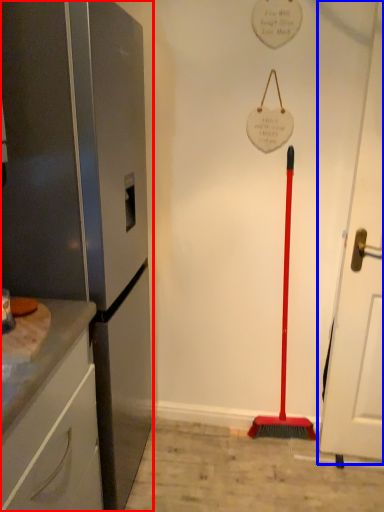
Question: Which object is further to the camera taking this photo, appliance (highlighted by a red box) or door (highlighted by a blue box)?

Choices:
 (A) appliance
 (B) door

Answer: (B)